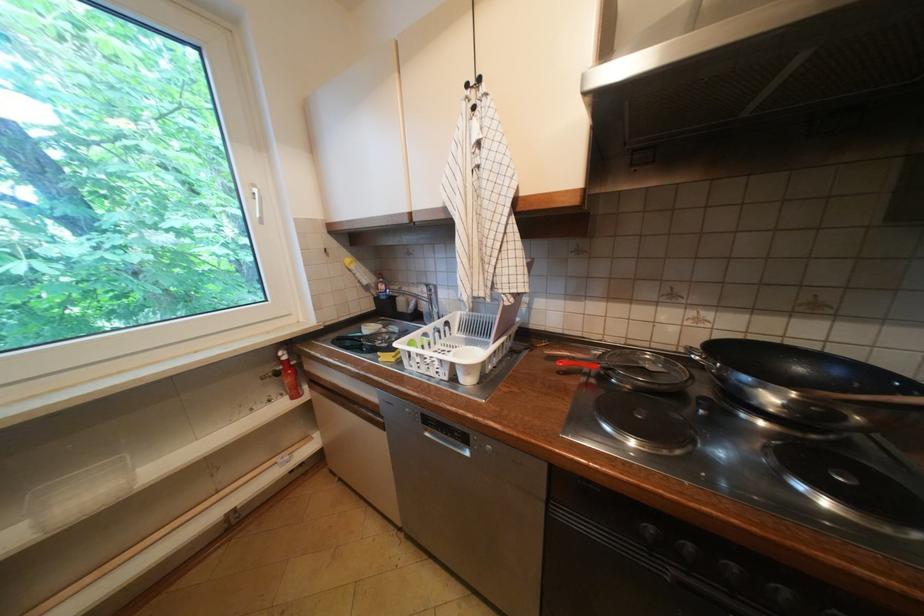
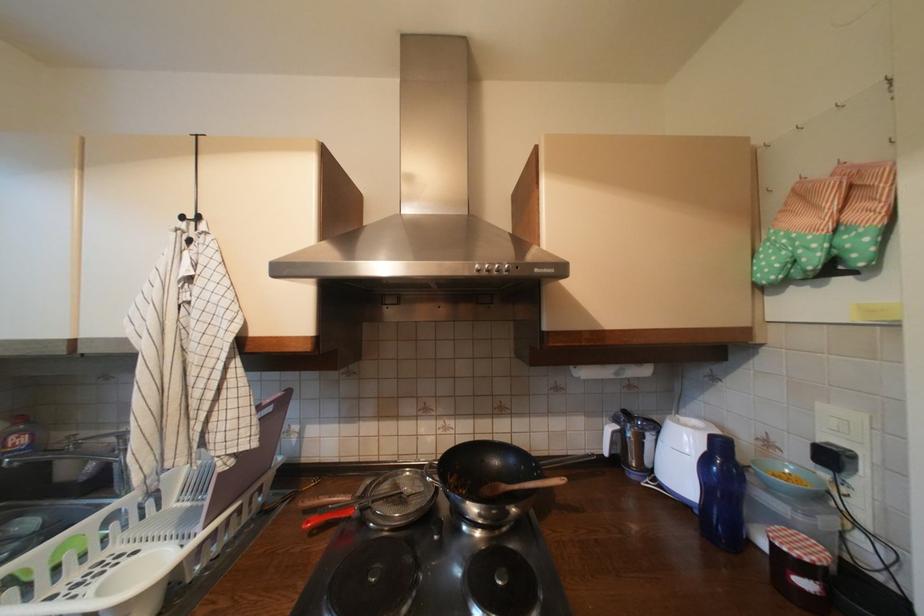
In the second image, find the point that corresponds to point (569, 363) in the first image.

(317, 524)